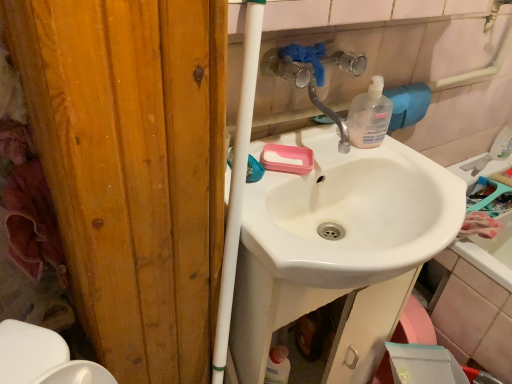
Identify the location of vacant area that is in front of translucent plastic soap dispenser at upper right. The width and height of the screenshot is (512, 384). (379, 158).